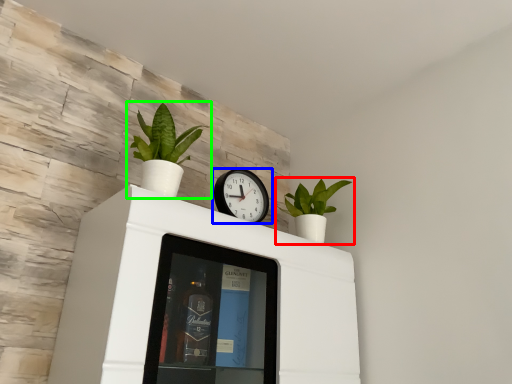
Question: Estimate the real-world distances between objects in this image. Which object is closer to houseplant (highlighted by a red box), wall clock (highlighted by a blue box) or houseplant (highlighted by a green box)?

Choices:
 (A) wall clock
 (B) houseplant

Answer: (A)